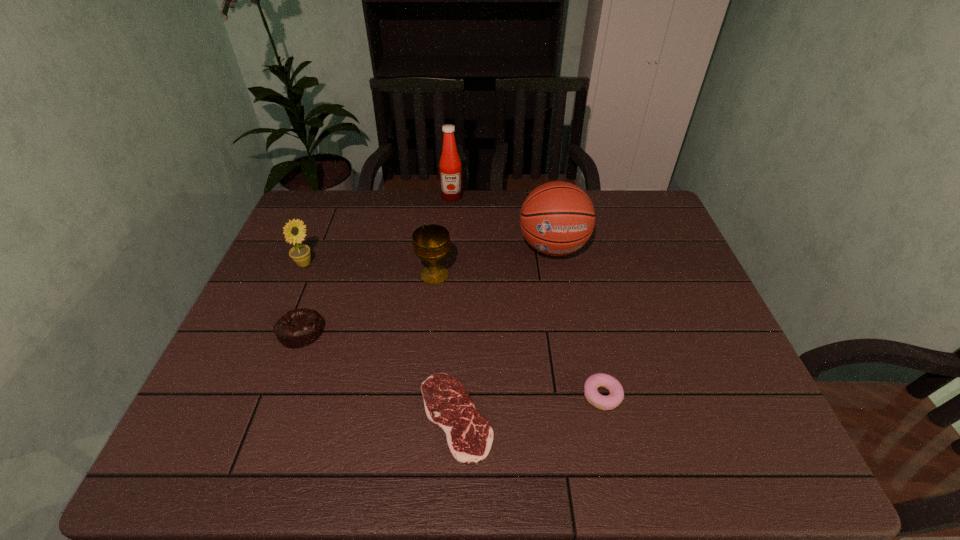
Identify the location of beanbag positioned at the left edge. This screenshot has height=540, width=960. (298, 328).

Identify the location of vacant space at the far edge of the desktop. (372, 221).

The width and height of the screenshot is (960, 540). I want to click on vacant space at the near edge, so click(489, 456).

You are a GUI agent. You are given a task and a screenshot of the screen. Output one action in this format:
    pyautogui.click(x=<x>, y=<y>)
    Task: Click on the free region at the left edge of the desktop
    This screenshot has width=960, height=540.
    Given the screenshot: What is the action you would take?
    pyautogui.click(x=298, y=286)

Where is `vacant space at the right edge of the desktop`? vacant space at the right edge of the desktop is located at coordinates (709, 350).

Locate an element on the screen. vacant space at the far left corner is located at coordinates (325, 218).

Locate an element on the screen. vacant space at the near right corner of the desktop is located at coordinates (704, 433).

Locate an element on the screen. Image resolution: width=960 pixels, height=540 pixels. free space between the doughnut and the sunflower is located at coordinates (453, 330).

Identify the location of vacant area that lies between the second shortest object and the chalice. Image resolution: width=960 pixels, height=540 pixels. (518, 336).

You are a GUI agent. You are given a task and a screenshot of the screen. Output one action in this format:
    pyautogui.click(x=<x>, y=<y>)
    Task: Click on the free space between the basketball and the third shortest object
    This screenshot has width=960, height=540.
    Given the screenshot: What is the action you would take?
    pyautogui.click(x=427, y=289)